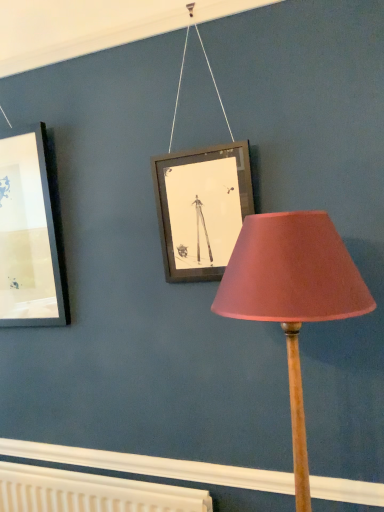
Question: Is white textured radiator at lower center inside the boundaries of pink fabric lampshade at center, or outside?

Choices:
 (A) inside
 (B) outside

Answer: (B)

Question: In the image, is white textured radiator at lower center positioned in front of or behind pink fabric lampshade at center?

Choices:
 (A) behind
 (B) front

Answer: (A)

Question: From their relative heights in the image, would you say white textured radiator at lower center is taller or shorter than pink fabric lampshade at center?

Choices:
 (A) short
 (B) tall

Answer: (A)

Question: Is pink fabric lampshade at center taller or shorter than white textured radiator at lower center?

Choices:
 (A) tall
 (B) short

Answer: (A)

Question: Visually, is pink fabric lampshade at center positioned to the left or to the right of white textured radiator at lower center?

Choices:
 (A) right
 (B) left

Answer: (A)

Question: Which is correct: pink fabric lampshade at center is inside white textured radiator at lower center, or outside of it?

Choices:
 (A) outside
 (B) inside

Answer: (A)

Question: Is point (243, 245) closer or farther from the camera than point (43, 485)?

Choices:
 (A) closer
 (B) farther

Answer: (A)